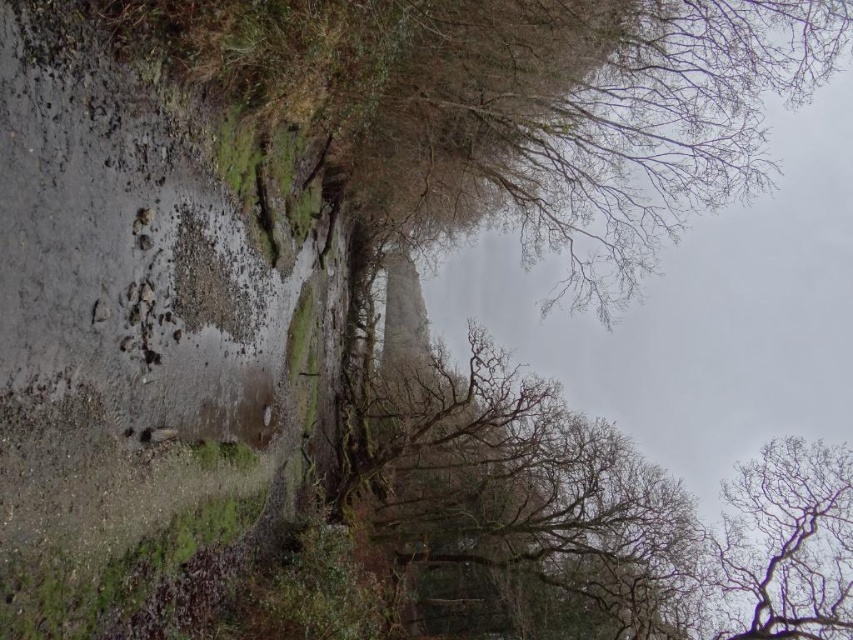
Question: Observing the image, what is the correct spatial positioning of damp soil at lower left in reference to bare branches at left?

Choices:
 (A) above
 (B) below

Answer: (B)

Question: Is the position of damp soil at lower left less distant than that of bare branches at upper right?

Choices:
 (A) no
 (B) yes

Answer: (B)

Question: Which object is the closest to the damp soil at lower left?

Choices:
 (A) bare branches at upper right
 (B) smooth bark tree at center

Answer: (B)

Question: Among these points, which one is farthest from the camera?

Choices:
 (A) (527, 141)
 (B) (74, 298)
 (C) (741, 616)
 (D) (683, 596)

Answer: (D)

Question: Which point is closer to the camera taking this photo?

Choices:
 (A) (772, 38)
 (B) (202, 189)

Answer: (B)

Question: Where is smooth bark tree at center located in relation to bare branches at upper right in the image?

Choices:
 (A) below
 (B) above

Answer: (B)